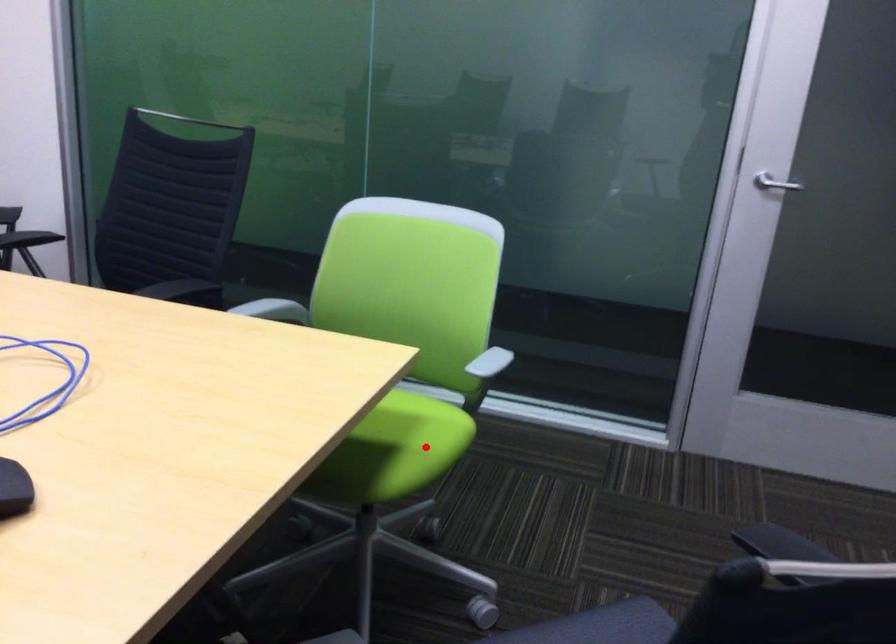
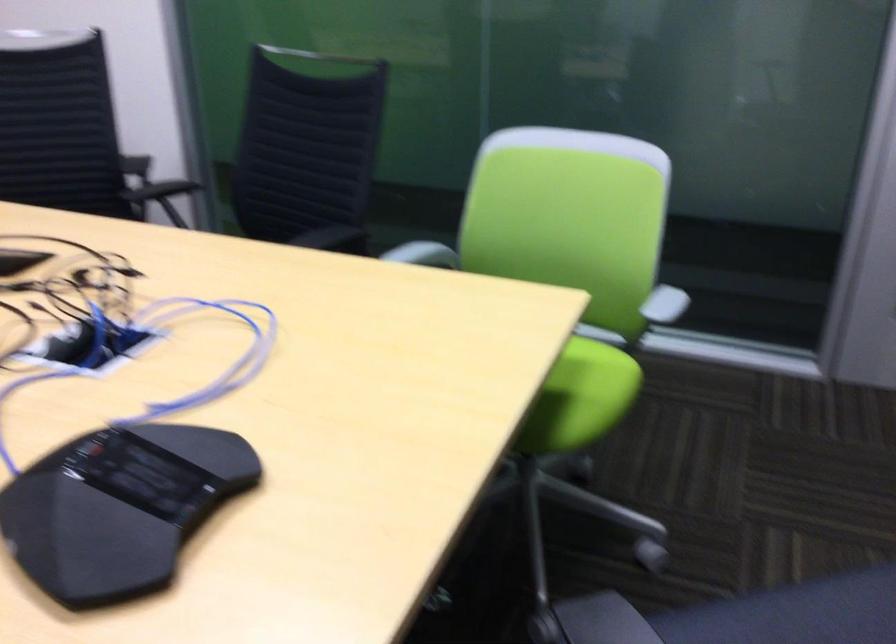
Find the pixel in the second image that matches the highlighted location in the first image.

(590, 392)